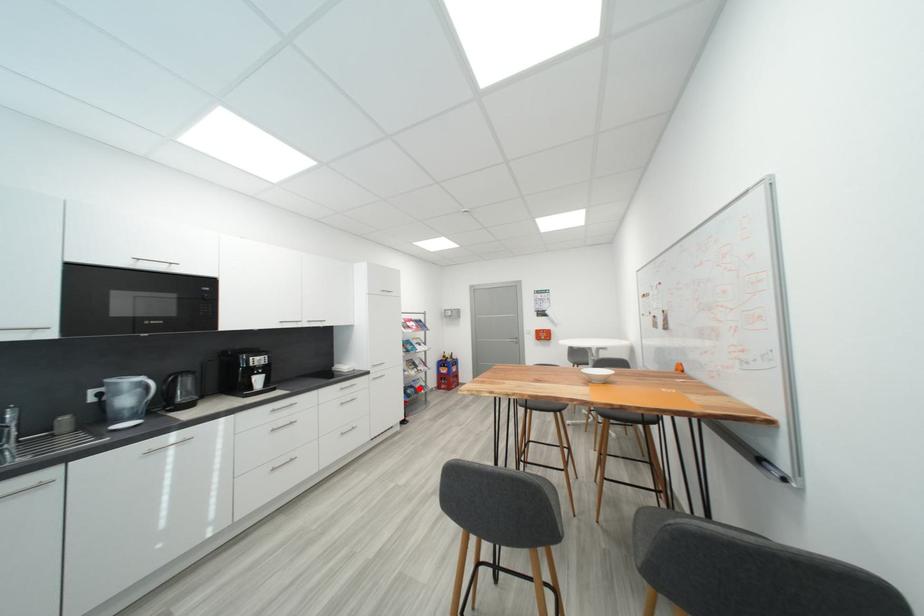
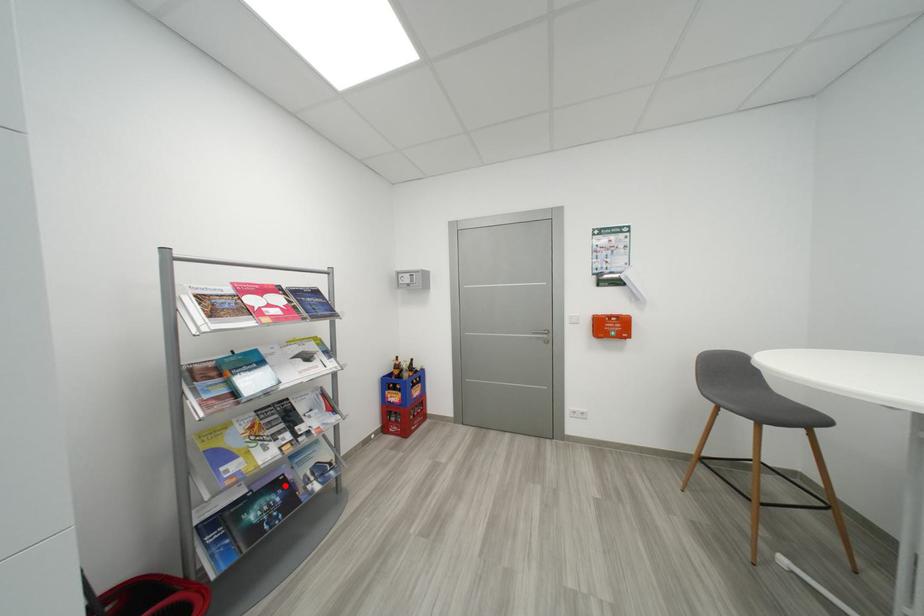
I am providing you with two images of the same scene from different viewpoints. A red point is marked on the first image and another point is marked on the second image. Do the highlighted points in image1 and image2 indicate the same real-world spot?

Yes